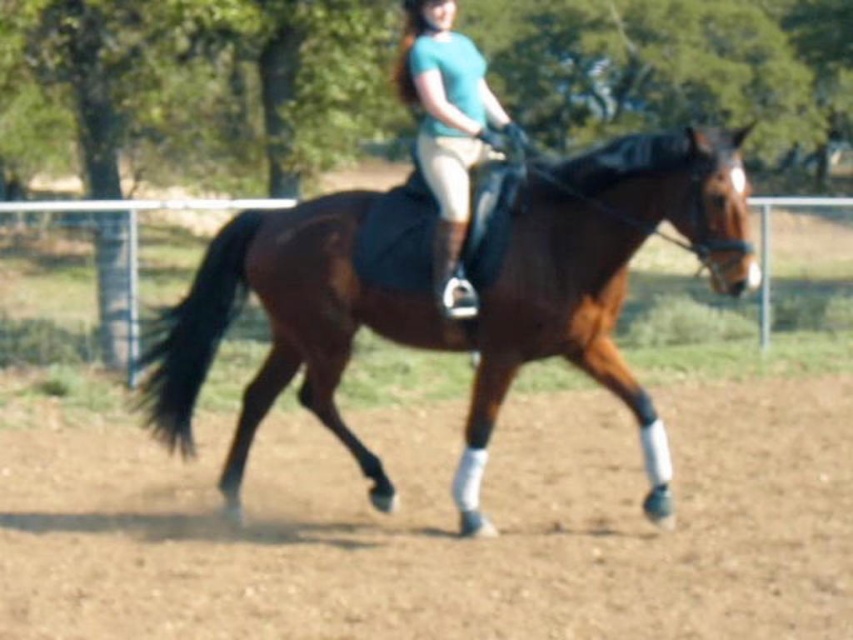
Looking at this image, you are standing in the equestrian arena and want to throw a small treat to the point marked as point [489,582]. If your throwing range is 7 meters, will you be able to reach it?

The distance between you and point [489,582] is 6.99 meters, which is within your throwing range of 7 meters. Yes, you can reach it.

You are standing at the point marked by coordinates point (444, 525) in the equestrian arena. Looking around, you see the brown dirt field at center. Which direction should you move to reach the chain link fence enclosing the area?

The point (444, 525) marks the brown dirt field at center. Since the chain link fence is in the background enclosing the area, you should move outward from the center towards the edges to reach the fence.

You are a photographer positioned at the edge of the arena. You want to capture a photo where the brown glossy horse at center is in the foreground and the brown dirt field at center is in the background. Is this arrangement possible based on their current positions?

The brown dirt field at center is in front of the brown glossy horse at center, so to have the horse in the foreground and the dirt field in the background, you would need to adjust their positions. Since the dirt field is already in front, the horse would be behind it, making the desired arrangement impossible without moving either the horse or the field.